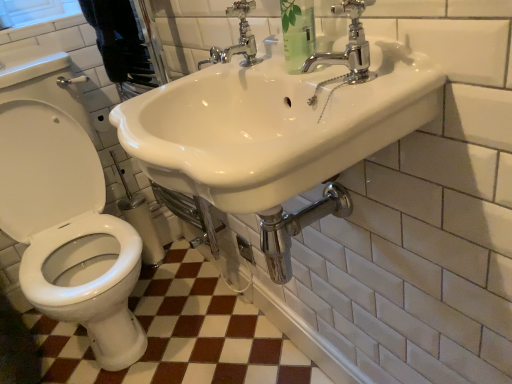
Question: Does chrome/metallic faucet at upper center, positioned as the second tap in front-to-back order, have a lesser width compared to white glossy toilet at left?

Choices:
 (A) no
 (B) yes

Answer: (B)

Question: Is white glossy toilet at left surrounded by chrome/metallic faucet at upper center, positioned as the second tap in front-to-back order?

Choices:
 (A) no
 (B) yes

Answer: (A)

Question: Is chrome/metallic faucet at upper center, positioned as the second tap in right-to-left order, at the left side of white glossy toilet at left?

Choices:
 (A) no
 (B) yes

Answer: (A)

Question: From a real-world perspective, does chrome/metallic faucet at upper center, positioned as the second tap in right-to-left order, sit lower than white glossy toilet at left?

Choices:
 (A) yes
 (B) no

Answer: (B)

Question: Is chrome/metallic faucet at upper center, positioned as the second tap in front-to-back order, smaller than white glossy toilet at left?

Choices:
 (A) no
 (B) yes

Answer: (B)

Question: From the image's perspective, is chrome/metallic faucet at upper center, positioned as the second tap in right-to-left order, over white glossy toilet at left?

Choices:
 (A) yes
 (B) no

Answer: (A)

Question: Considering the relative sizes of clear plastic bottle at upper center and white glossy toilet at left in the image provided, is clear plastic bottle at upper center taller than white glossy toilet at left?

Choices:
 (A) no
 (B) yes

Answer: (A)

Question: Considering the relative positions of clear plastic bottle at upper center and white glossy toilet at left in the image provided, is clear plastic bottle at upper center to the right of white glossy toilet at left from the viewer's perspective?

Choices:
 (A) no
 (B) yes

Answer: (B)

Question: Is clear plastic bottle at upper center not within white glossy toilet at left?

Choices:
 (A) no
 (B) yes

Answer: (B)

Question: From the image's perspective, would you say clear plastic bottle at upper center is positioned over white glossy toilet at left?

Choices:
 (A) no
 (B) yes

Answer: (B)

Question: Is clear plastic bottle at upper center with white glossy toilet at left?

Choices:
 (A) yes
 (B) no

Answer: (B)

Question: Is white glossy toilet at left at the back of clear plastic bottle at upper center?

Choices:
 (A) no
 (B) yes

Answer: (A)

Question: Considering the relative sizes of white glossy sink at upper center and clear plastic bottle at upper center in the image provided, is white glossy sink at upper center bigger than clear plastic bottle at upper center?

Choices:
 (A) no
 (B) yes

Answer: (B)